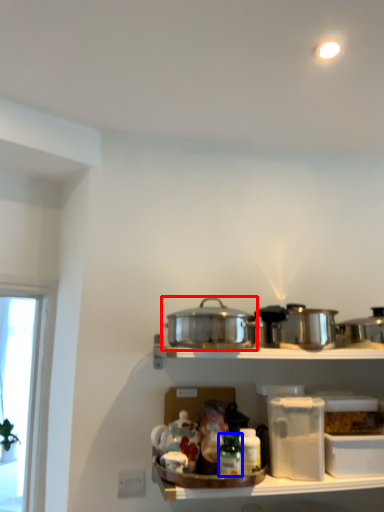
Question: Which object appears closest to the camera in this image, crock pot (highlighted by a red box) or bottle (highlighted by a blue box)?

Choices:
 (A) crock pot
 (B) bottle

Answer: (A)